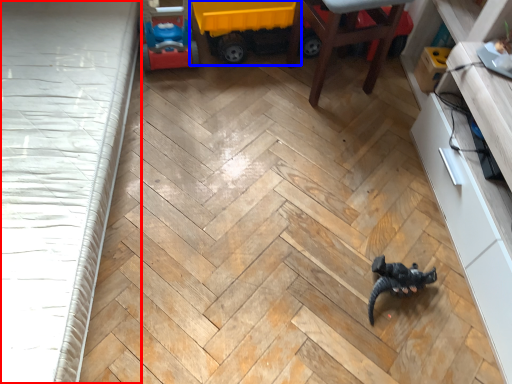
Question: Among these objects, which one is nearest to the camera, bed frame (highlighted by a red box) or toy (highlighted by a blue box)?

Choices:
 (A) bed frame
 (B) toy

Answer: (A)